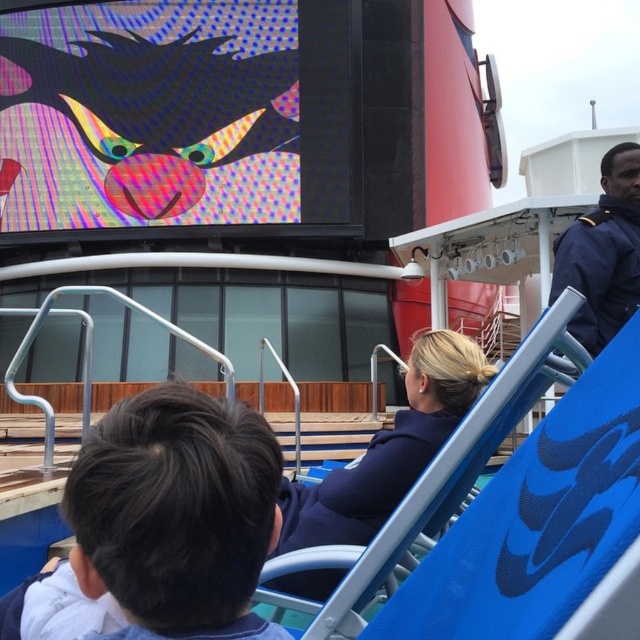
Consider the image. Which of these two, navy blue coat at center or blue uniform at upper right, stands shorter?

Standing shorter between the two is navy blue coat at center.

Does navy blue coat at center appear under blue uniform at upper right?

Yes, navy blue coat at center is below blue uniform at upper right.

Does point (342, 500) come behind point (625, 280)?

No, it is not.

Find the location of a particular element. This screenshot has height=640, width=640. navy blue coat at center is located at coordinates (388, 449).

Does multicolored pixelated screen at upper left have a larger size compared to navy blue coat at center?

Yes, multicolored pixelated screen at upper left is bigger than navy blue coat at center.

Is multicolored pixelated screen at upper left positioned behind navy blue coat at center?

Yes, it is behind navy blue coat at center.

Who is more distant from viewer, (328, 17) or (424, 433)?

Point (328, 17)

Where is `multicolored pixelated screen at upper left`? Image resolution: width=640 pixels, height=640 pixels. multicolored pixelated screen at upper left is located at coordinates (176, 115).

Is point (278, 196) positioned behind point (579, 230)?

Yes.

Consider the image. Does multicolored pixelated screen at upper left appear under blue uniform at upper right?

No.

Is point (145, 108) more distant than point (604, 324)?

Yes, it is.

This screenshot has width=640, height=640. In order to click on multicolored pixelated screen at upper left in this screenshot , I will do `click(176, 115)`.